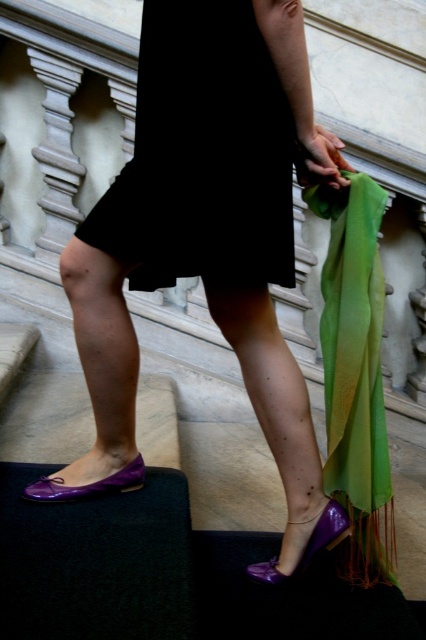
You are a fashion designer trying to create a new outfit. You see the black matte dress at center and the purple glossy sandal at lower center. Which item has a greater width measurement?

The black matte dress at center has a greater width measurement than the purple glossy sandal at lower center.

You are a fashion designer observing the image. You need to determine the spatial arrangement of the purple glossy shoes at lower left and the purple glossy sandal at lower center. Which one is positioned to the left?

The purple glossy shoes at lower left are positioned to the left of the purple glossy sandal at lower center.